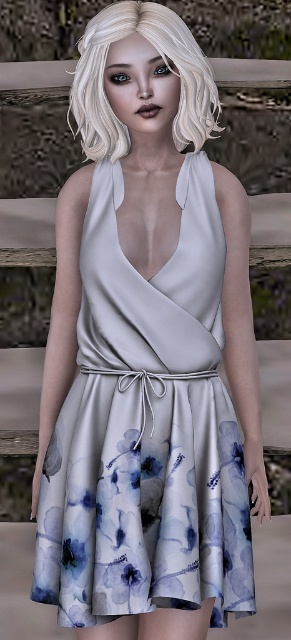
You are a fashion designer who needs to ensure the dress and hair accessories will fit within a display case. The case has a width of 20 inches. Can both the satin floral dress at center and the blonde silky hair at upper center fit side by side in the case without overlapping?

The satin floral dress at center is 21.00 inches from the blonde silky hair at upper center, meaning there isn

You are a fashion designer observing the image. You need to determine which object occupies more vertical space in the composition. Which one is taller between the satin floral dress at center and the blonde silky hair at upper center?

The satin floral dress at center has a greater height compared to the blonde silky hair at upper center, so the satin floral dress at center is taller.

Consider the image. Where is the satin floral dress at center located in the image?

The satin floral dress at center is located at point (x=146, y=429) in the image.